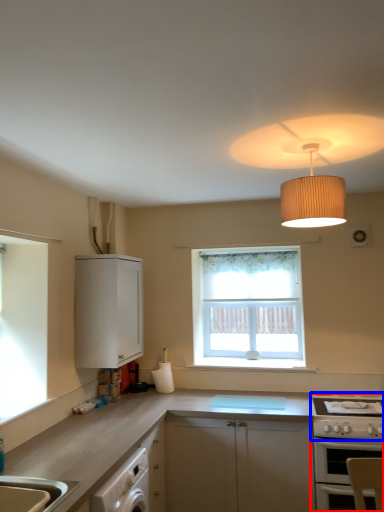
Question: Among these objects, which one is nearest to the camera, oven (highlighted by a red box) or gas stove (highlighted by a blue box)?

Choices:
 (A) oven
 (B) gas stove

Answer: (A)